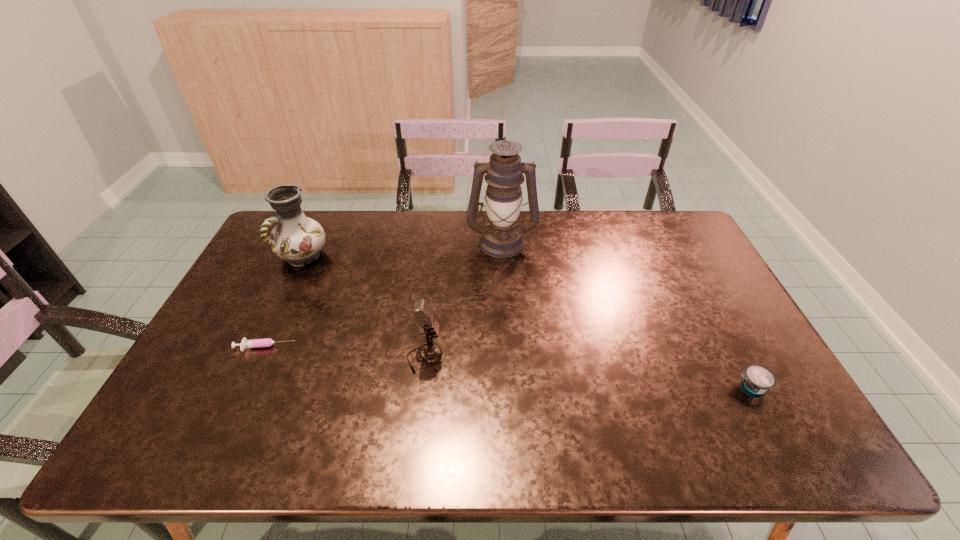
Find the location of a particular element. vacant space that's between the tallest object and the second tallest object is located at coordinates 402,249.

Image resolution: width=960 pixels, height=540 pixels. Identify the location of vacant area that lies between the tallest object and the vase. (402, 249).

Image resolution: width=960 pixels, height=540 pixels. Find the location of `the third closest object relative to the yogurt`. the third closest object relative to the yogurt is located at coordinates (266, 342).

Select which object is the closest to the rightmost object. Please provide its 2D coordinates. Your answer should be formatted as a tuple, i.e. [(x, y)], where the tuple contains the x and y coordinates of a point satisfying the conditions above.

[(502, 237)]

At what (x,y) coordinates should I click in order to perform the action: click on vacant point that satisfies the following two spatial constraints: 1. on the front-facing side of the fourth tallest object; 2. on the left side of the microphone. Please return your answer as a coordinate pair (x, y). This screenshot has width=960, height=540. Looking at the image, I should click on (423, 386).

The width and height of the screenshot is (960, 540). In order to click on free spot that satisfies the following two spatial constraints: 1. on the front-facing side of the third tallest object; 2. on the left side of the yogurt in this screenshot , I will do `click(423, 386)`.